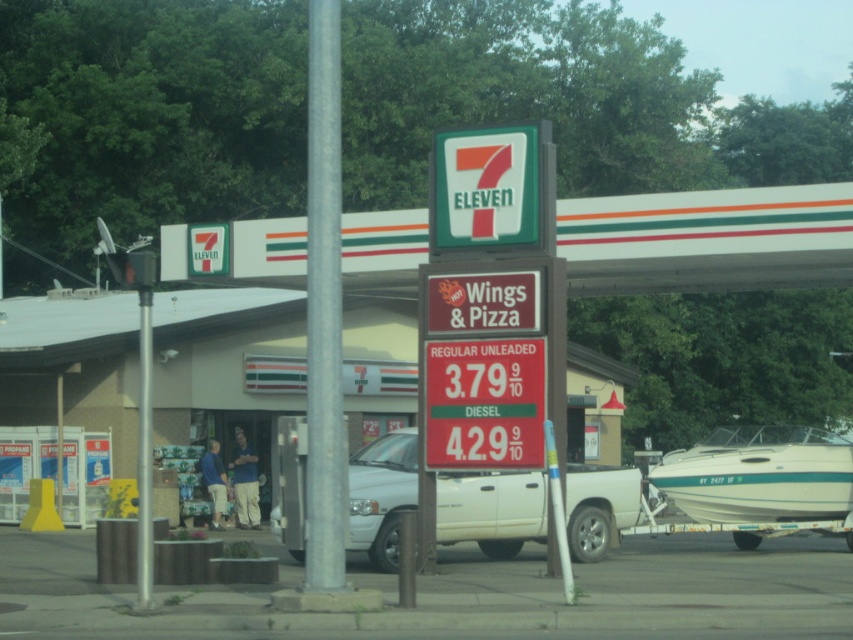
Question: Can you confirm if red plastic sign at center is positioned above green plastic sign at upper center?

Choices:
 (A) yes
 (B) no

Answer: (B)

Question: Which of the following is the farthest from the observer?

Choices:
 (A) green plastic sign at upper center
 (B) metallic gray pole at left
 (C) red plastic sign at center
 (D) silver metallic pole at center

Answer: (A)

Question: Does white glossy boat at lower right have a larger size compared to green plastic sign at upper center?

Choices:
 (A) yes
 (B) no

Answer: (A)

Question: Based on their relative distances, which object is nearer to the silver metallic pole at center?

Choices:
 (A) metallic gray pole at left
 (B) white matte truck at center
 (C) red plastic sign at center

Answer: (C)

Question: Which of these objects is positioned closest to the green plastic sign at upper center?

Choices:
 (A) silver metallic pole at center
 (B) metallic gray pole at left
 (C) white glossy boat at lower right
 (D) white matte truck at center

Answer: (A)

Question: Where is white glossy boat at lower right located in relation to green plastic sign at upper center in the image?

Choices:
 (A) right
 (B) left

Answer: (A)